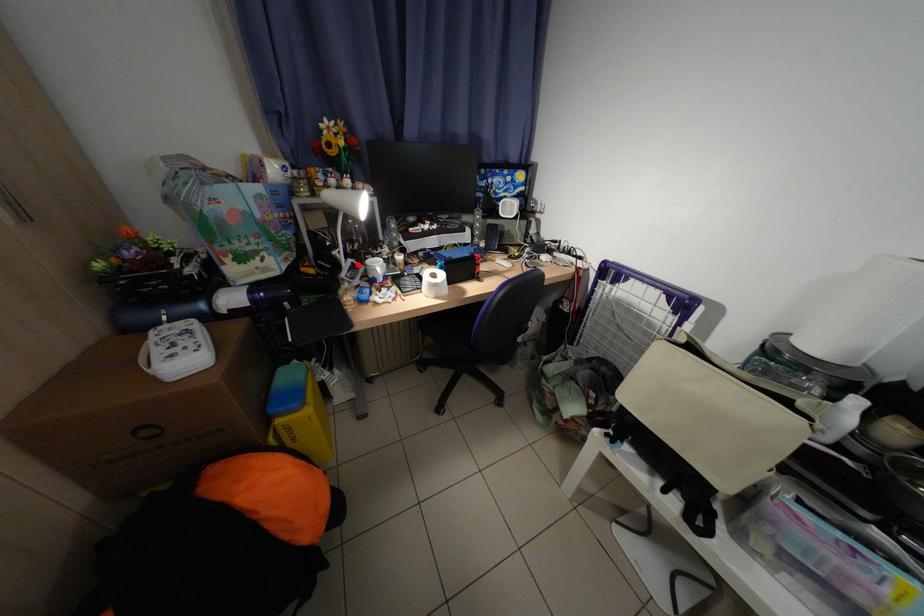
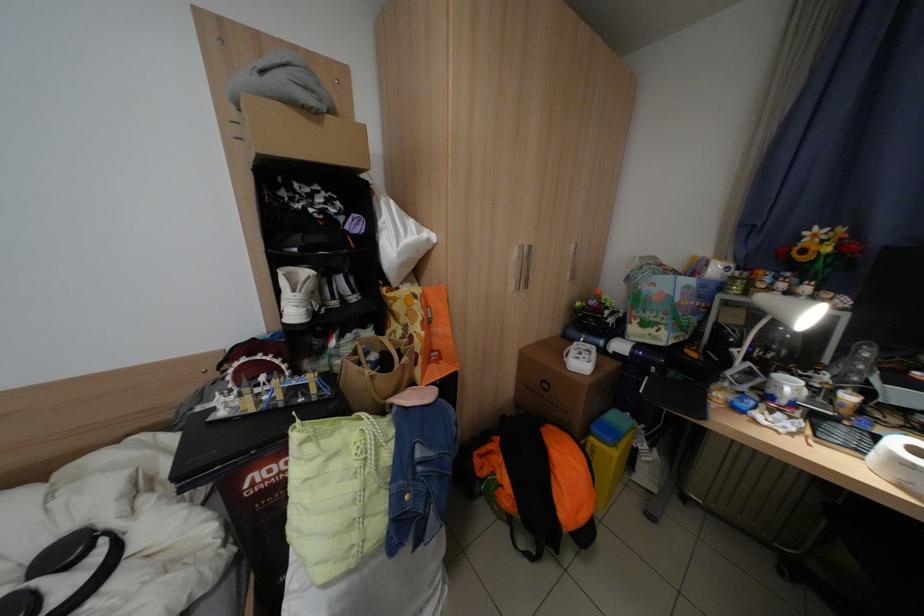
In the second image, find the point that corresponds to the highlighted location in the first image.

(752, 366)